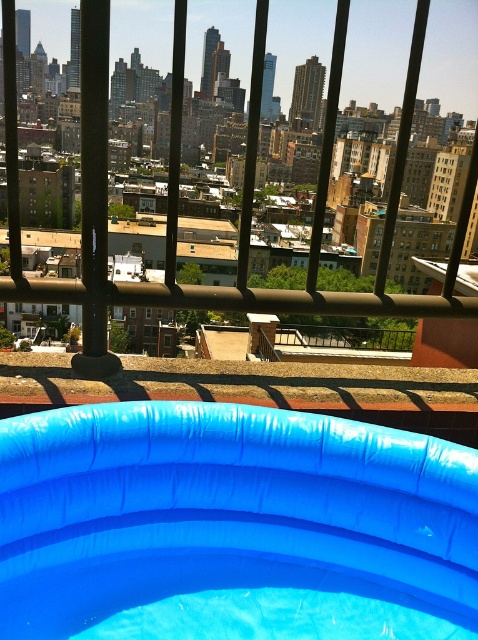
Question: Which point appears farthest from the camera in this image?

Choices:
 (A) (108, 412)
 (B) (335, 22)

Answer: (B)

Question: Which object appears farthest from the camera in this image?

Choices:
 (A) blue rubber pool at lower center
 (B) blue rubber pool at center

Answer: (A)

Question: Is blue rubber pool at center below blue rubber pool at lower center?

Choices:
 (A) yes
 (B) no

Answer: (A)

Question: From the image, what is the correct spatial relationship of blue rubber pool at center in relation to blue rubber pool at lower center?

Choices:
 (A) left
 (B) right

Answer: (A)

Question: Which point is closer to the camera taking this photo?

Choices:
 (A) (242, 598)
 (B) (104, 93)

Answer: (A)

Question: Is blue rubber pool at center bigger than blue rubber pool at lower center?

Choices:
 (A) yes
 (B) no

Answer: (B)